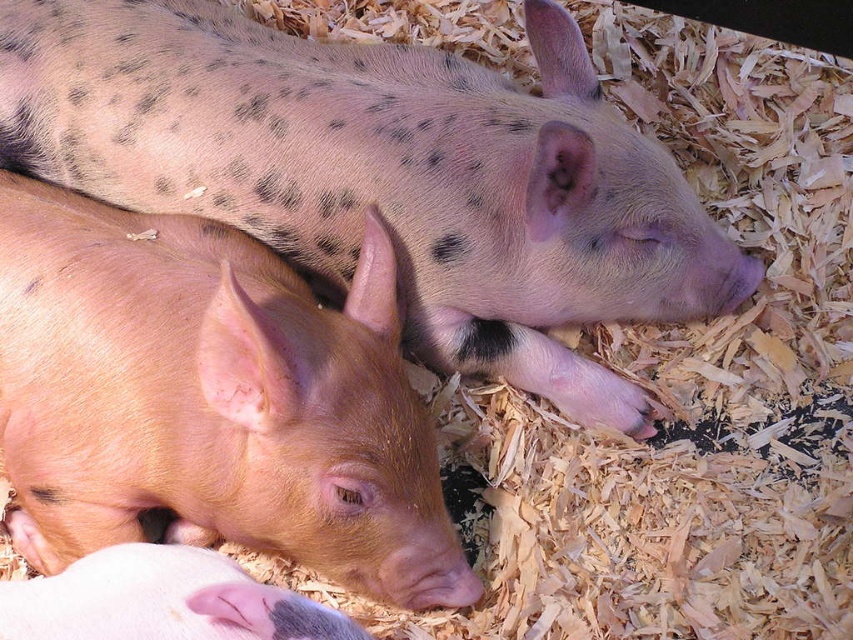
Based on the photo, is pink smooth piglet at lower left positioned behind pink smooth skin at lower left?

Yes, pink smooth piglet at lower left is further from the viewer.

Is pink smooth piglet at lower left positioned in front of pink smooth skin at lower left?

No.

Where is `pink smooth piglet at lower left`? The width and height of the screenshot is (853, 640). pink smooth piglet at lower left is located at coordinates (212, 397).

Who is lower down, spotted pink pig at upper center or pink smooth piglet at lower left?

pink smooth piglet at lower left is below.

Consider the image. Does spotted pink pig at upper center appear on the left side of pink smooth piglet at lower left?

Incorrect, spotted pink pig at upper center is not on the left side of pink smooth piglet at lower left.

This screenshot has height=640, width=853. I want to click on spotted pink pig at upper center, so click(381, 173).

Is spotted pink pig at upper center in front of pink smooth skin at lower left?

No, it is behind pink smooth skin at lower left.

Looking at this image, who is positioned more to the right, spotted pink pig at upper center or pink smooth skin at lower left?

From the viewer's perspective, spotted pink pig at upper center appears more on the right side.

Image resolution: width=853 pixels, height=640 pixels. In order to click on spotted pink pig at upper center in this screenshot , I will do [x=381, y=173].